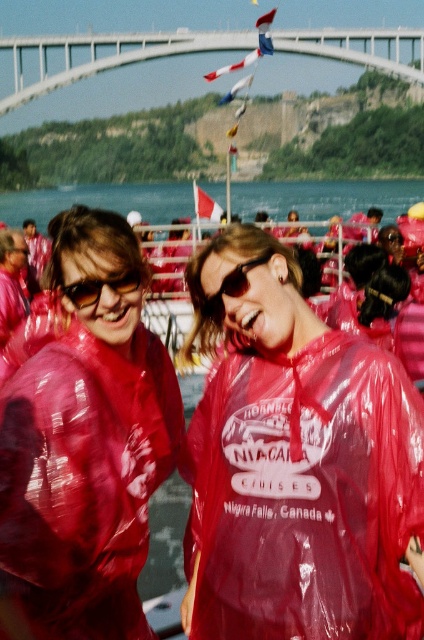
Measure the distance between white concrete bridge at upper center and camera.

The distance of white concrete bridge at upper center from camera is 591.92 feet.

Does white concrete bridge at upper center come behind matte black sunglasses at left?

Yes, it is behind matte black sunglasses at left.

Based on the photo, who is more distant from viewer, (x=153, y=52) or (x=97, y=280)?

Positioned behind is point (x=153, y=52).

You are a GUI agent. You are given a task and a screenshot of the screen. Output one action in this format:
    pyautogui.click(x=<x>, y=<y>)
    Task: Click on the white concrete bridge at upper center
    The height and width of the screenshot is (640, 424).
    Given the screenshot: What is the action you would take?
    pyautogui.click(x=95, y=56)

Does glossy plastic poncho at center appear on the left side of white concrete bridge at upper center?

Indeed, glossy plastic poncho at center is positioned on the left side of white concrete bridge at upper center.

Describe the element at coordinates (86, 445) in the screenshot. I see `glossy plastic poncho at center` at that location.

Locate an element on the screen. The image size is (424, 640). glossy plastic poncho at center is located at coordinates (86, 445).

Does transparent plastic raincoat at center come behind transparent plastic water at center?

No, it is not.

Is point (226, 572) closer to camera compared to point (396, 209)?

Yes.

Which is in front, point (273, 282) or point (44, 198)?

Point (273, 282)

At what (x,y) coordinates should I click in order to perform the action: click on transparent plastic raincoat at center. Please return your answer as a coordinate pair (x, y). The image size is (424, 640). Looking at the image, I should click on (298, 467).